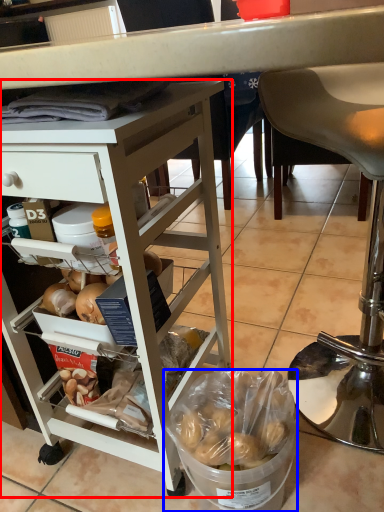
Question: Which object appears closest to the camera in this image, desk (highlighted by a red box) or bowl (highlighted by a blue box)?

Choices:
 (A) desk
 (B) bowl

Answer: (A)